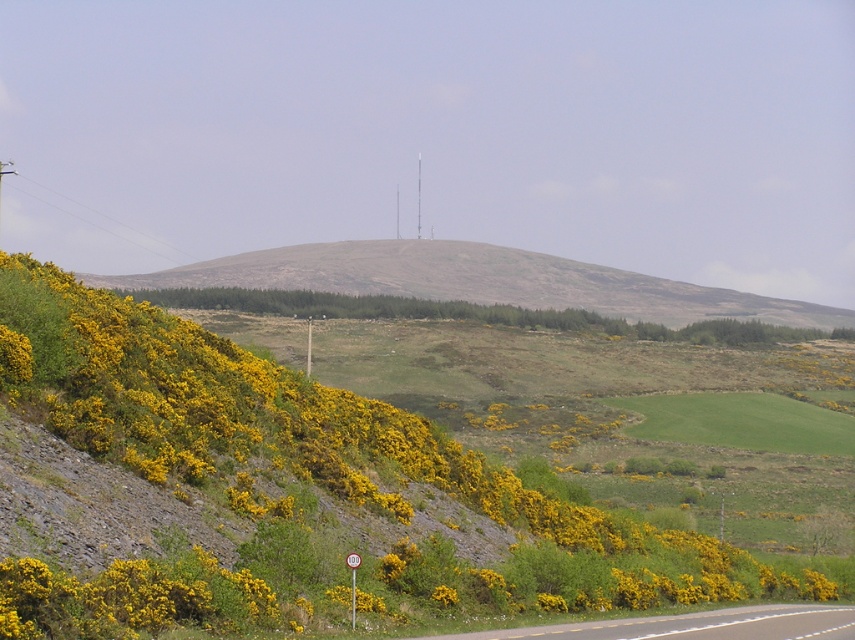
Which is below, yellow rough textured bush at left or asphalt road at lower right?

asphalt road at lower right

Does yellow rough textured bush at left have a lesser height compared to asphalt road at lower right?

In fact, yellow rough textured bush at left may be taller than asphalt road at lower right.

Consider the image. Who is more distant from viewer, (187, 387) or (588, 627)?

Positioned behind is point (187, 387).

At what (x,y) coordinates should I click in order to perform the action: click on yellow rough textured bush at left. Please return your answer as a coordinate pair (x, y). The width and height of the screenshot is (855, 640). Looking at the image, I should click on [x=302, y=486].

What do you see at coordinates (302, 486) in the screenshot? This screenshot has width=855, height=640. I see `yellow rough textured bush at left` at bounding box center [302, 486].

Where is `yellow rough textured bush at left`? This screenshot has width=855, height=640. yellow rough textured bush at left is located at coordinates (302, 486).

Based on the photo, does grassy hillside at center appear on the left side of asphalt road at lower right?

Indeed, grassy hillside at center is positioned on the left side of asphalt road at lower right.

Can you confirm if grassy hillside at center is positioned below asphalt road at lower right?

Incorrect, grassy hillside at center is not positioned below asphalt road at lower right.

This screenshot has width=855, height=640. Find the location of `grassy hillside at center`. grassy hillside at center is located at coordinates (478, 282).